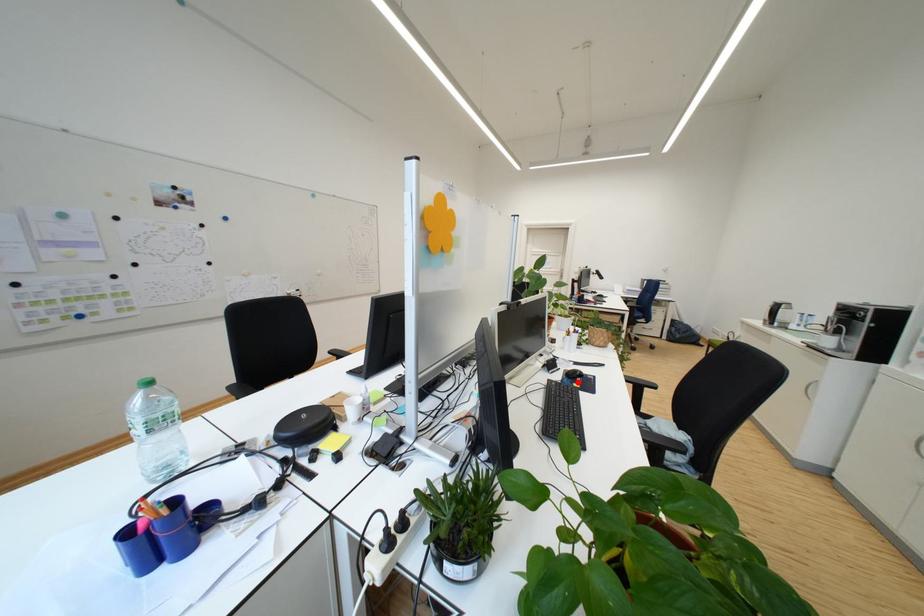
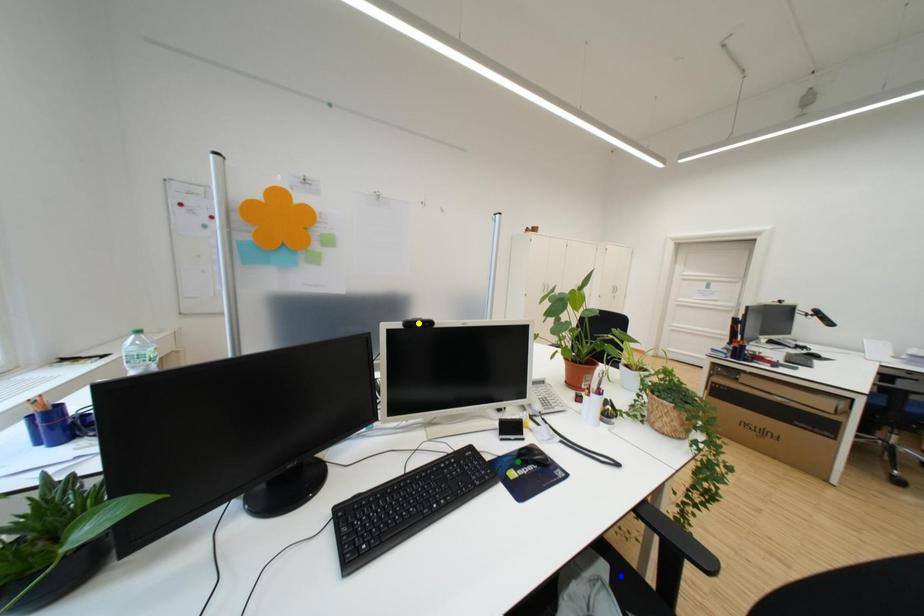
Question: I am providing you with two images of the same scene from different viewpoints. A red point is marked on the first image. You are given multiple points on the second image. Which mark in image 2 goes with the point in image 1?

Choices:
 (A) green point
 (B) blue point
 (C) yellow point

Answer: (A)